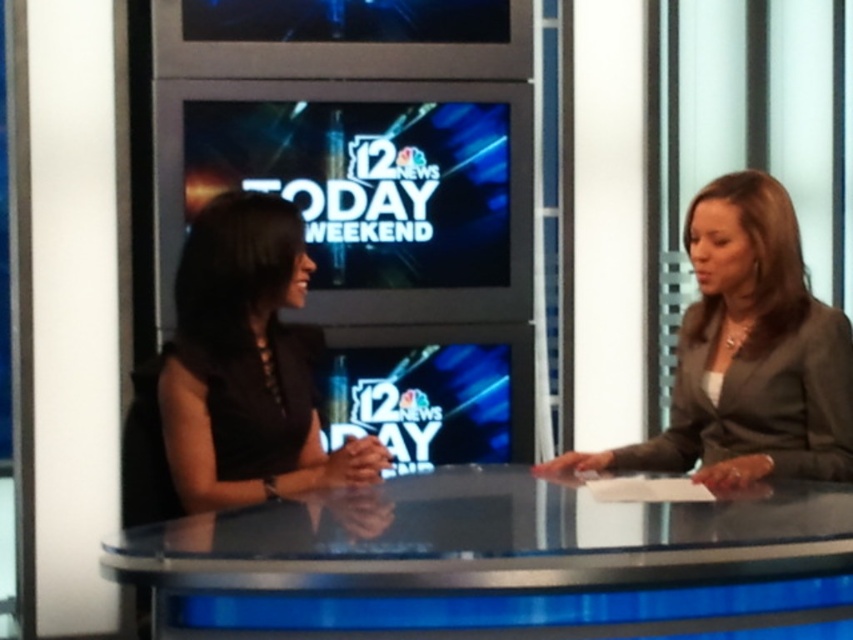
You are a camera operator in a news studio. You need to focus on two points in the scene. The first point is point (643, 563) and the second is point (245, 257). Which point is closer to the camera?

Point (643, 563) is closer to the viewer than point (245, 257).

In the news studio scene, there are two people behind a reflective desk. One is wearing a sleeveless black top on the left, and the other is wearing a gray blazer over a white top at right. There is also a point marked at coordinates (747,355) which corresponds to an object in the scene. Which person is wearing the dark gray suit mentioned by the point?

The point at (747,355) marks the dark gray suit at right, so the individual on the right wearing the gray blazer over a white top is the one wearing the dark gray suit.